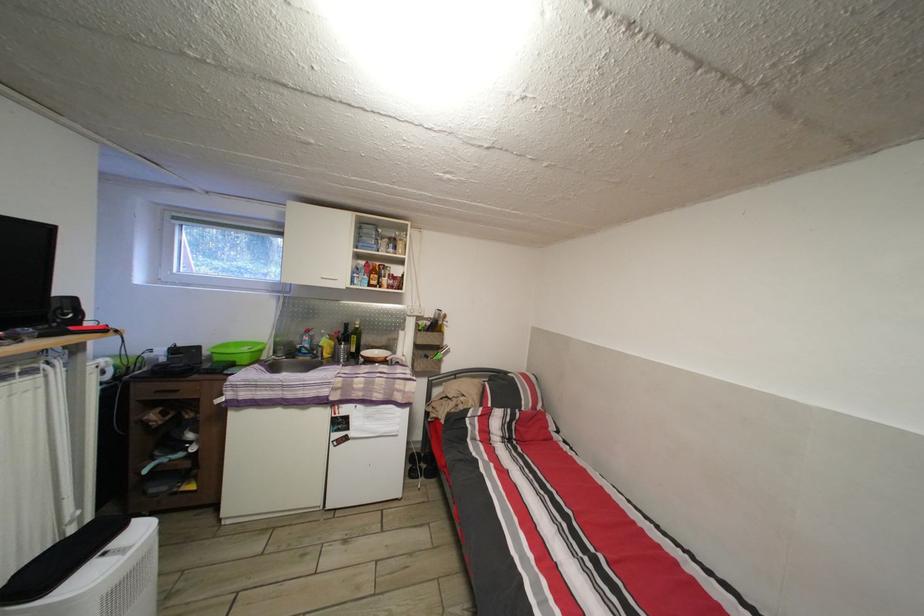
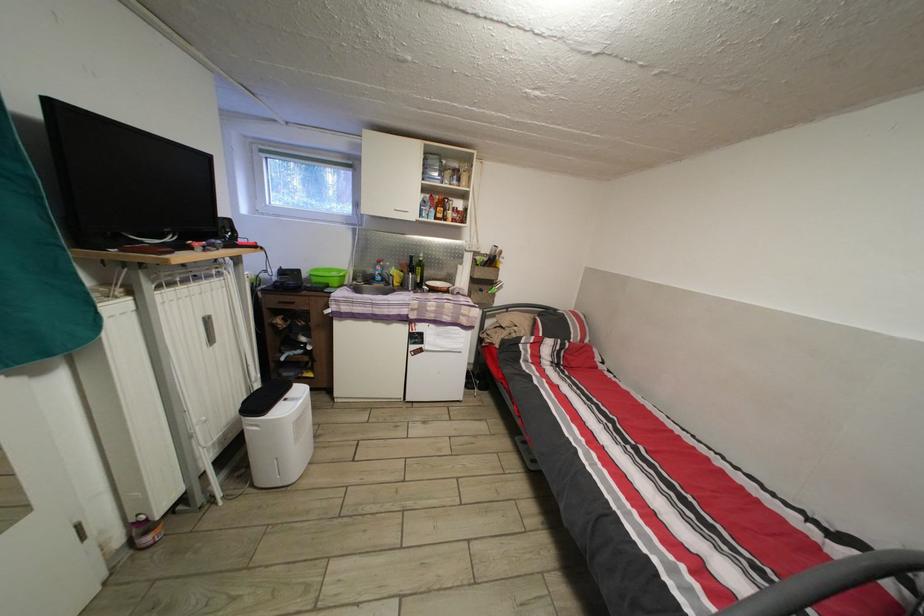
Find the pixel in the second image that matches point 181,225 in the first image.

(269, 156)